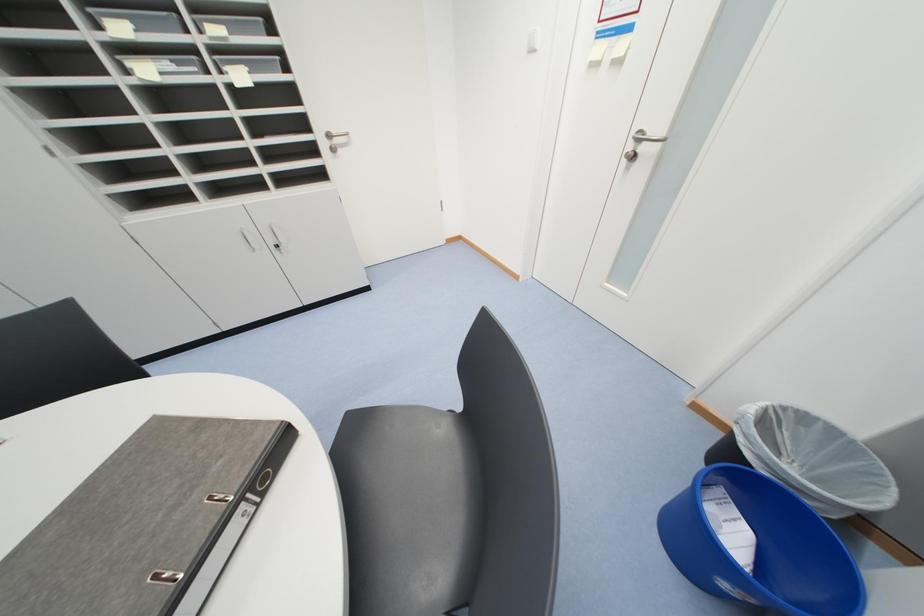
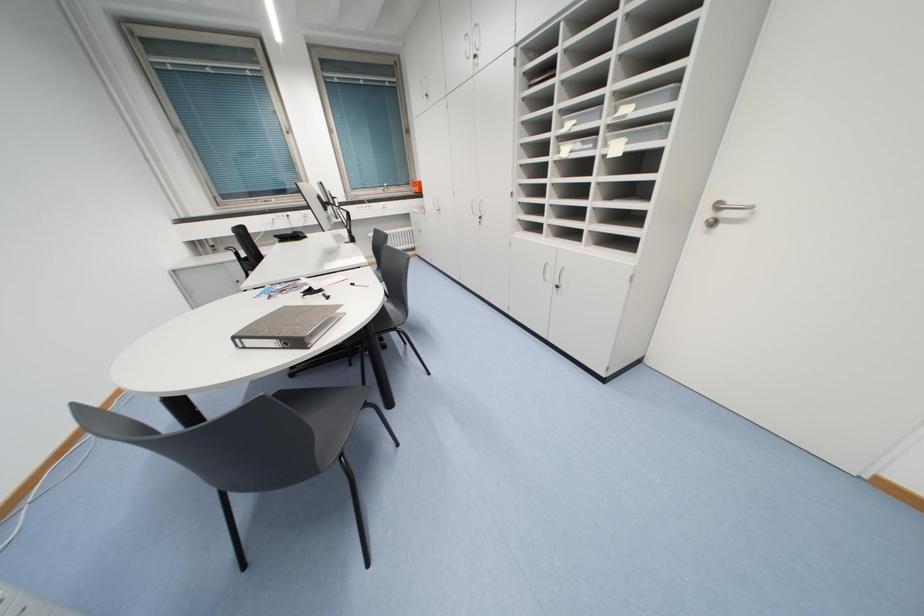
Based on the continuous images, in which direction is the camera rotating?

The camera rotated toward left-down.